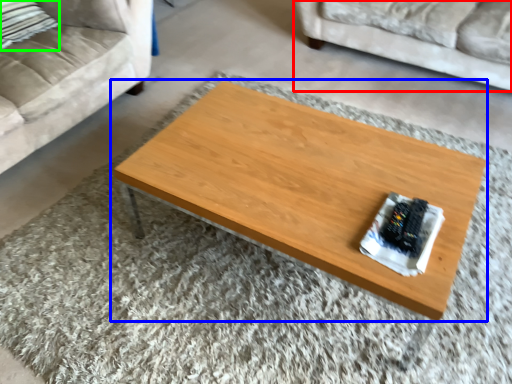
Question: Considering the real-world distances, which object is farthest from studio couch (highlighted by a red box)? coffee table (highlighted by a blue box) or pillow (highlighted by a green box)?

Choices:
 (A) coffee table
 (B) pillow

Answer: (B)